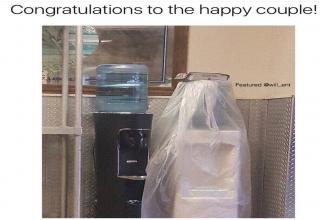
Identify the location of shelf. (61, 131).